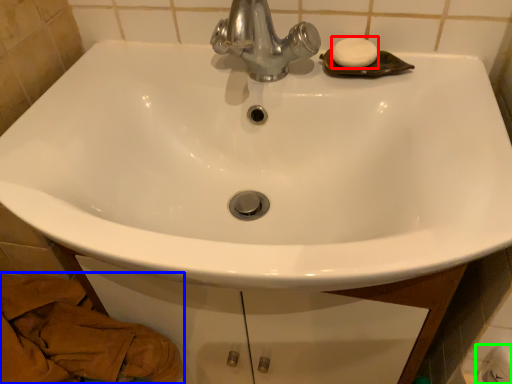
Question: Based on their relative distances, which object is farther from soap (highlighted by a red box)? Choose from material (highlighted by a blue box) and toilet paper (highlighted by a green box).

Choices:
 (A) material
 (B) toilet paper

Answer: (A)